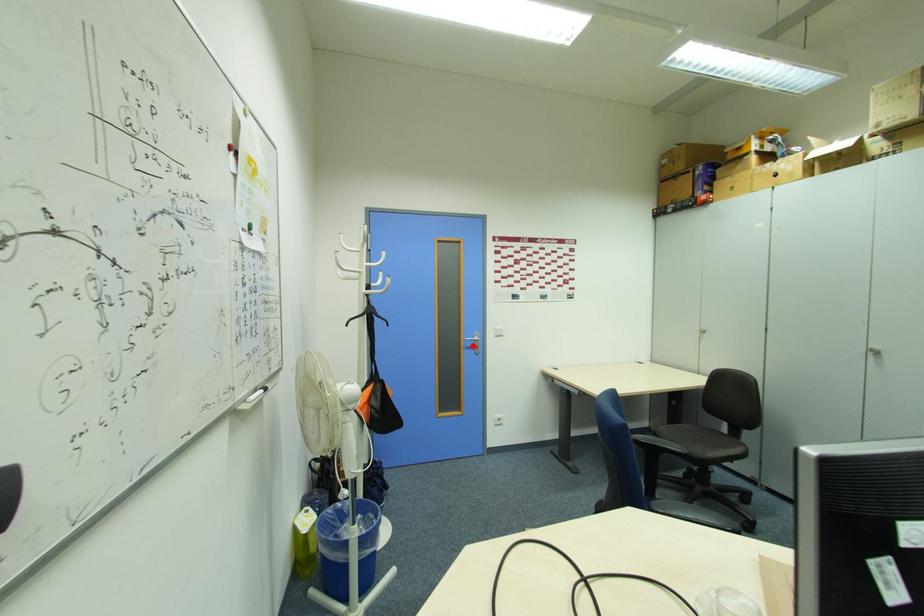
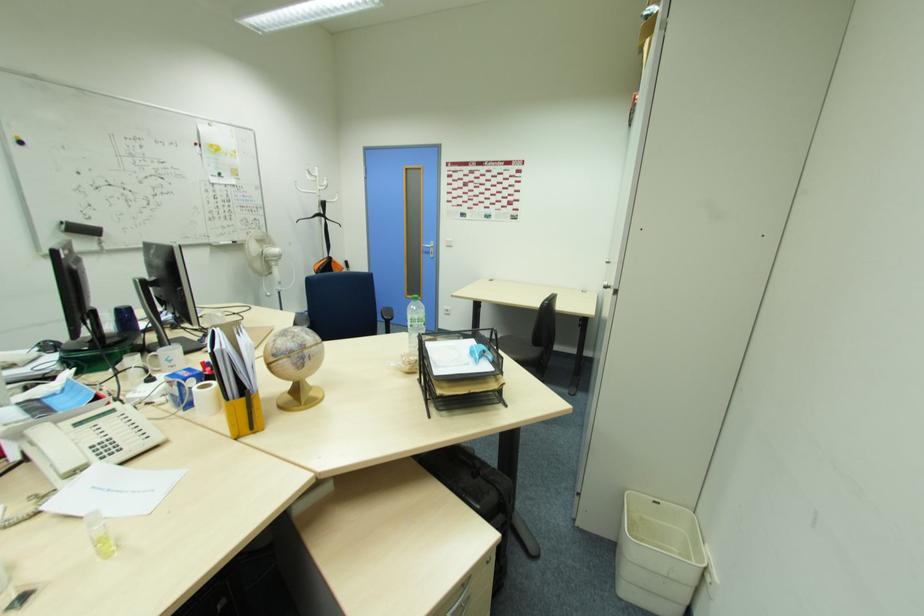
Question: I am providing you with two images of the same scene from different viewpoints. Image1 has a red point marked. In image2, the corresponding 3D location appears at what relative position? Reply with the corresponding letter.

Choices:
 (A) Closer
 (B) Farther

Answer: (A)